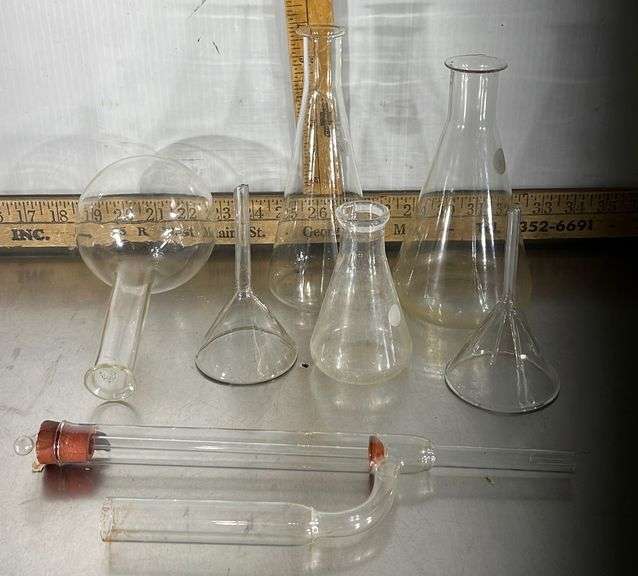
Locate an element on the screen. This screenshot has width=638, height=576. counter is located at coordinates (499, 532).